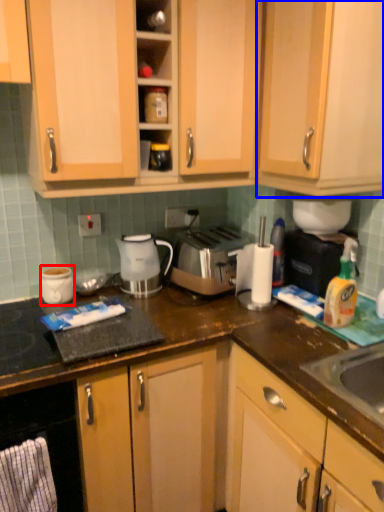
Question: Which object is closer to the camera taking this photo, appliance (highlighted by a red box) or cabinetry (highlighted by a blue box)?

Choices:
 (A) appliance
 (B) cabinetry

Answer: (B)